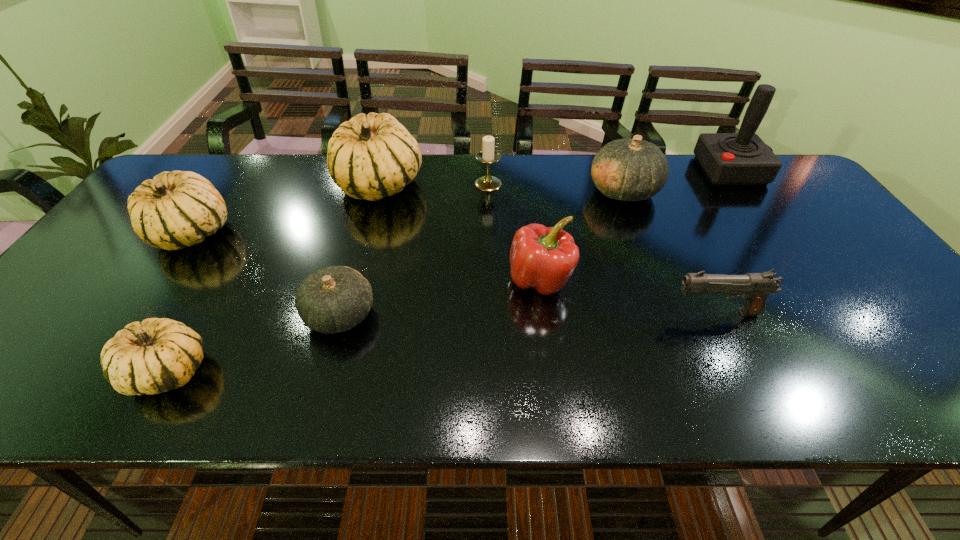
Identify the location of pepper. The image size is (960, 540). (544, 258).

Find the location of `gun`. gun is located at coordinates (754, 288).

Where is `the left orange gourd`? the left orange gourd is located at coordinates (334, 299).

This screenshot has width=960, height=540. What are the coordinates of `the nearer orange gourd` in the screenshot? It's located at (334, 299).

The width and height of the screenshot is (960, 540). I want to click on the nearest white gourd, so click(x=156, y=355).

The height and width of the screenshot is (540, 960). I want to click on vacant area situated 0.320m on the base of the joystick, so click(599, 170).

Where is `free spot located on the base of the joystick`? The height and width of the screenshot is (540, 960). free spot located on the base of the joystick is located at coordinates (612, 170).

Where is `vacant space located 0.160m on the base of the joystick`? The image size is (960, 540). vacant space located 0.160m on the base of the joystick is located at coordinates (650, 170).

Where is `free location located 0.060m on the left of the tallest gourd`? The width and height of the screenshot is (960, 540). free location located 0.060m on the left of the tallest gourd is located at coordinates (317, 185).

The height and width of the screenshot is (540, 960). In order to click on free spot located on the front of the bigger orange gourd in this screenshot , I will do `click(661, 291)`.